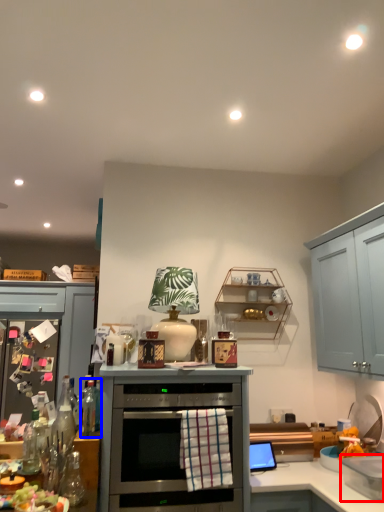
Question: Which object appears closest to the camera in this image, appliance (highlighted by a red box) or bottle (highlighted by a blue box)?

Choices:
 (A) appliance
 (B) bottle

Answer: (A)